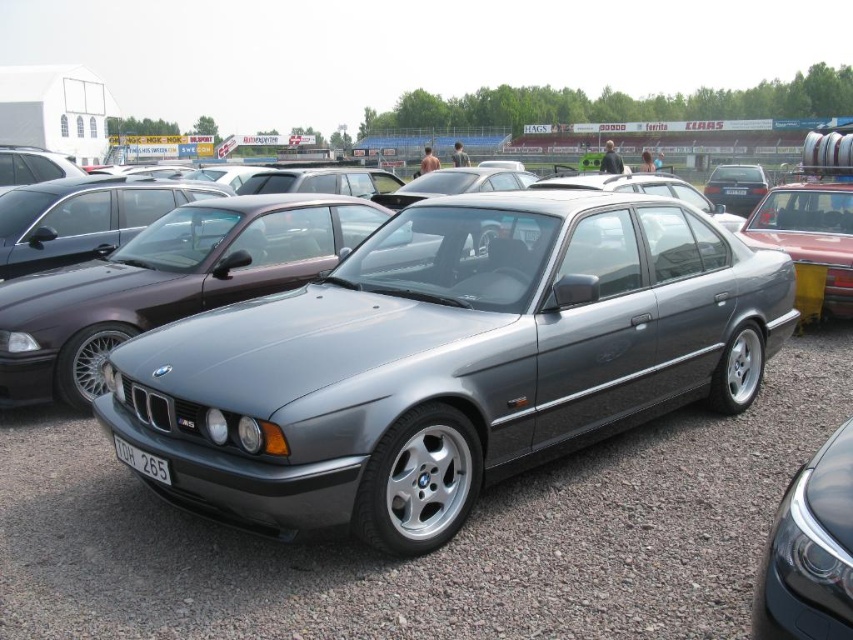
Between satin black headlight at center and satin black sedan at upper right, which one has more height?

Standing taller between the two is satin black sedan at upper right.

Can you confirm if satin black headlight at center is wider than satin black sedan at upper right?

No.

Which is behind, point (781, 600) or point (726, 195)?

Point (726, 195)

What are the coordinates of `satin black headlight at center` in the screenshot? It's located at (810, 550).

Based on the photo, is the position of satin metallic sedan at center less distant than that of metallic silver sedan at right?

Yes, satin metallic sedan at center is closer to the viewer.

Does satin metallic sedan at center have a larger size compared to metallic silver sedan at right?

Yes.

Does point (437, 346) come in front of point (809, 193)?

That is True.

Where is `satin metallic sedan at center`? satin metallic sedan at center is located at coordinates (447, 358).

Which of these two, satin black car at left or white plastic license plate at lower center, stands shorter?

Standing shorter between the two is white plastic license plate at lower center.

Is satin black car at left taller than white plastic license plate at lower center?

Indeed, satin black car at left has a greater height compared to white plastic license plate at lower center.

Does point (16, 224) come behind point (154, 476)?

Yes, point (16, 224) is behind point (154, 476).

The height and width of the screenshot is (640, 853). Identify the location of satin black car at left. (84, 216).